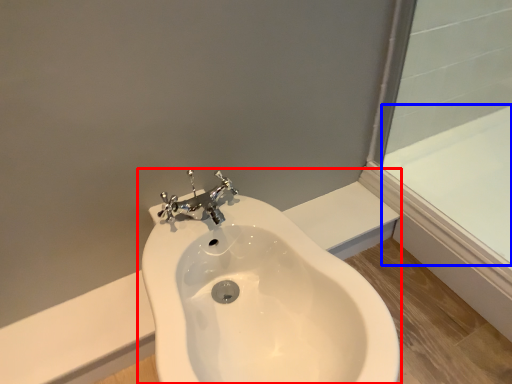
Question: Which object appears closest to the camera in this image, sink (highlighted by a red box) or bath (highlighted by a blue box)?

Choices:
 (A) sink
 (B) bath

Answer: (A)